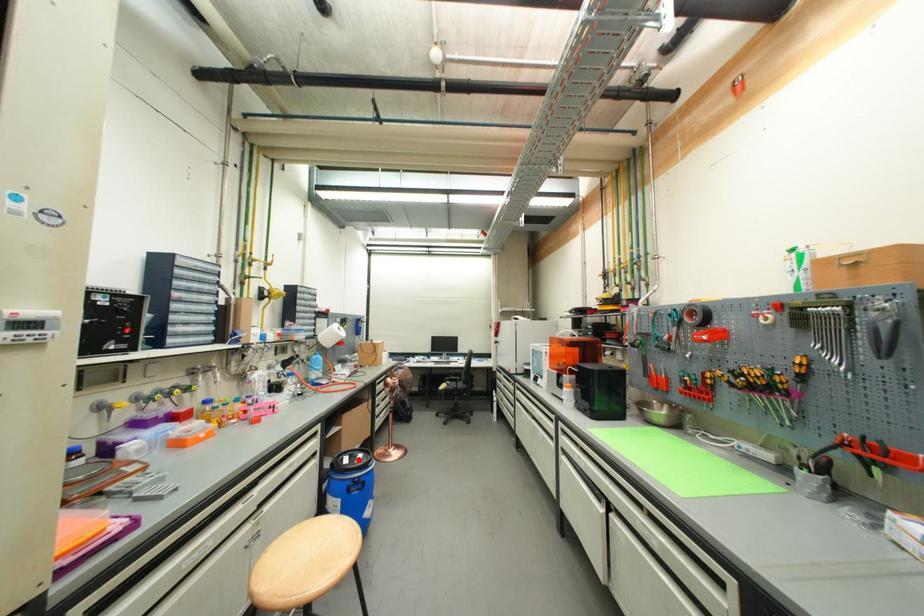
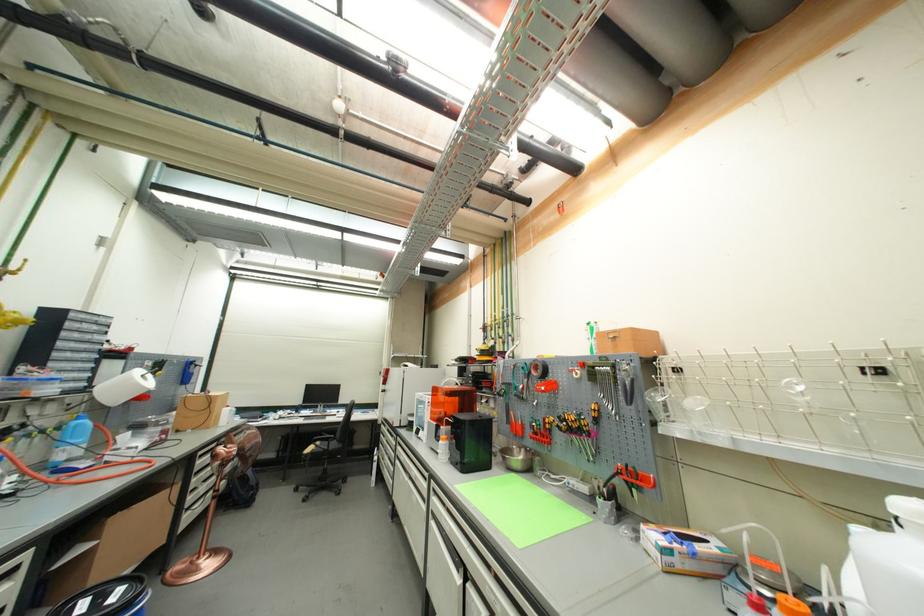
Where in the second image is the point corresponding to the highlighted location from the first image?

(106, 601)